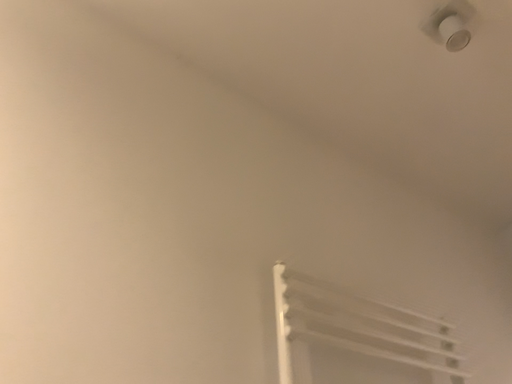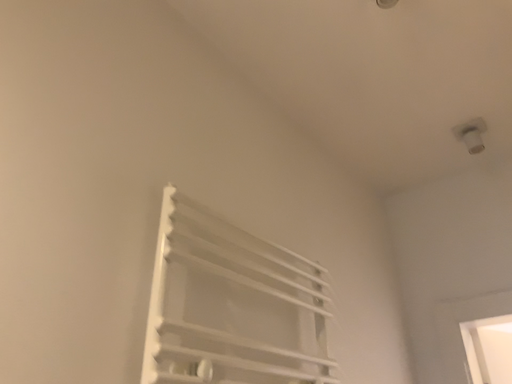
Question: Which way did the camera rotate in the video?

Choices:
 (A) rotated right
 (B) rotated left

Answer: (A)